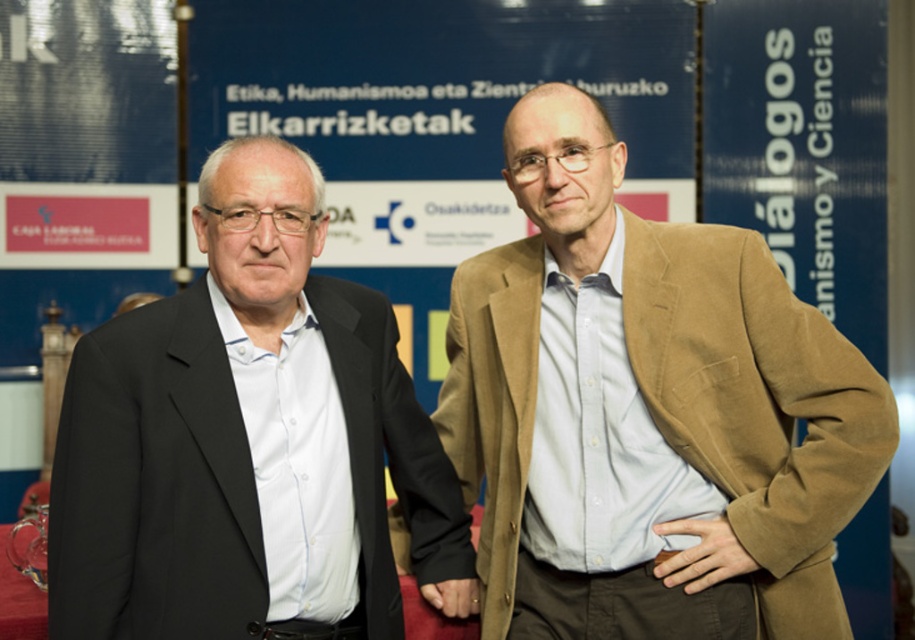
You are a photographer standing at a certain distance from the light brown suede blazer at center. If you want to take a closeup shot of the blazer, would you need to move closer or farther away?

The light brown suede blazer at center is 2.55 meters away from the camera. To take a closeup shot, you would need to move closer to reduce the distance between the camera and the blazer.

You are an observer looking at the two men in the image. You notice the light brown suede blazer at center and the smooth skin hand at center. Which object is positioned closer to you?

The light brown suede blazer at center is closer to the viewer than the smooth skin hand at center.